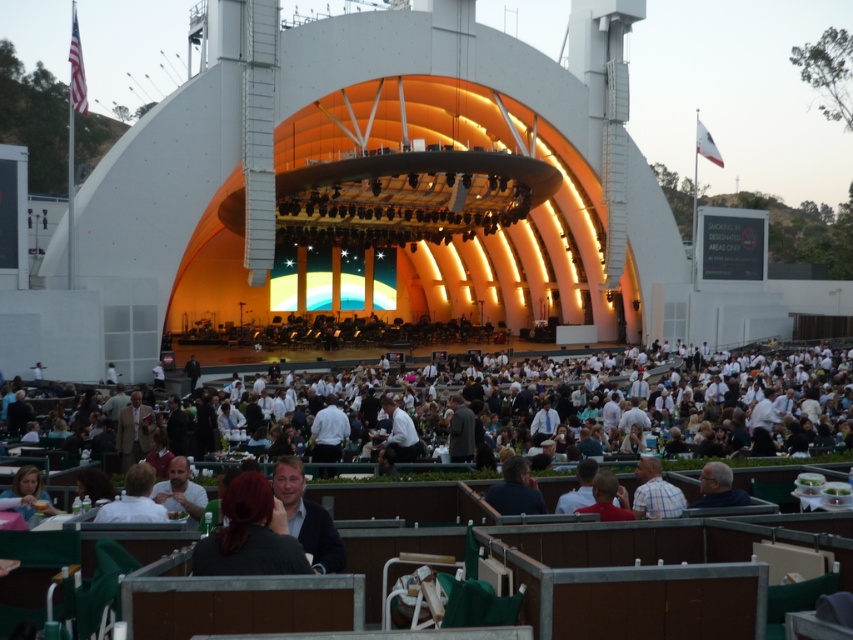
You are standing at the point with coordinates (306, 516) in the Hollywood Bowl amphitheater. What object is located at that point?

The point at coordinates (306, 516) is located on a dark brown sweater at lower center.

You are a photographer at the concert and want to capture both the dark brown sweater at lower center and the white shirt at center in a single shot. Which clothing item will appear narrower in the photo?

The dark brown sweater at lower center will appear narrower in the photo since it is thinner than the white shirt at center.